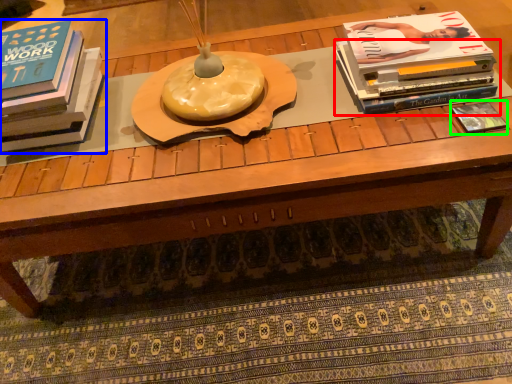
Question: Estimate the real-world distances between objects in this image. Which object is closer to book (highlighted by a red box), book (highlighted by a blue box) or book (highlighted by a green box)?

Choices:
 (A) book
 (B) book

Answer: (B)